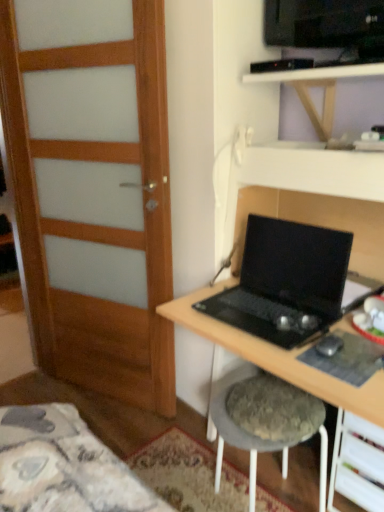
The width and height of the screenshot is (384, 512). Identify the location of vacant region in front of black rubber mouse at lower right. (344, 368).